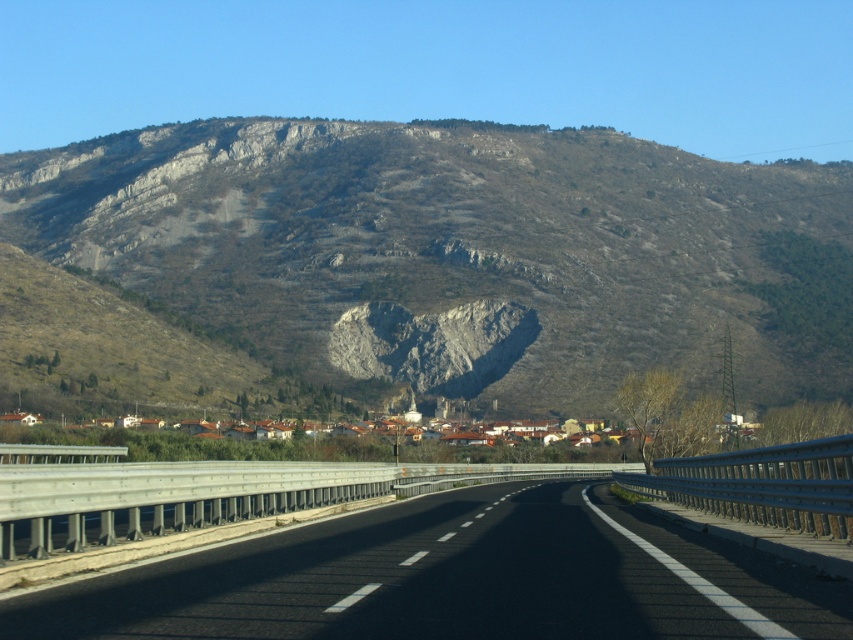
Question: Is gray rocky mountain at center to the right of black asphalt highway at center from the viewer's perspective?

Choices:
 (A) no
 (B) yes

Answer: (A)

Question: Is gray rocky mountain at center further to the viewer compared to black asphalt highway at center?

Choices:
 (A) yes
 (B) no

Answer: (A)

Question: Which object appears closest to the camera in this image?

Choices:
 (A) gray rocky mountain at center
 (B) black asphalt highway at center

Answer: (B)

Question: In this image, where is gray rocky mountain at center located relative to black asphalt highway at center?

Choices:
 (A) left
 (B) right

Answer: (A)

Question: Which point is closer to the camera?

Choices:
 (A) black asphalt highway at center
 (B) gray rocky mountain at center

Answer: (A)